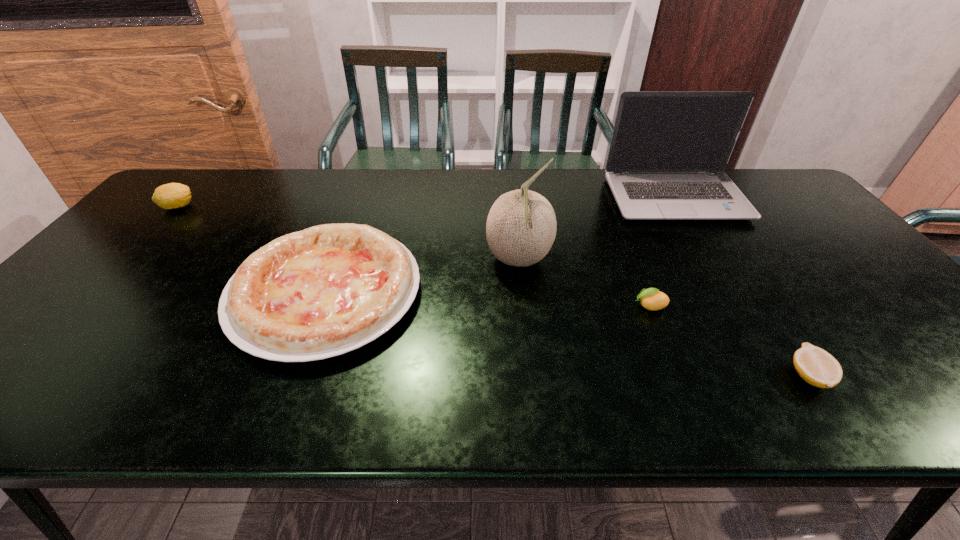
The height and width of the screenshot is (540, 960). Identify the location of laptop computer. (669, 149).

Where is `the fourth object from right to left`? the fourth object from right to left is located at coordinates (521, 226).

Find the location of a particular element. The width and height of the screenshot is (960, 540). pizza is located at coordinates tap(329, 289).

This screenshot has width=960, height=540. Identify the location of the leftmost lemon. (173, 195).

At what (x,y) coordinates should I click in order to perform the action: click on the farthest lemon. Please return your answer as a coordinate pair (x, y). This screenshot has height=540, width=960. Looking at the image, I should click on (173, 195).

At what (x,y) coordinates should I click in order to perform the action: click on the second lemon from left to right. Please return your answer as a coordinate pair (x, y). Looking at the image, I should click on (652, 299).

This screenshot has height=540, width=960. What are the coordinates of `the rightmost lemon` in the screenshot? It's located at (817, 367).

Find the location of a particular element. The image size is (960, 540). free space located on the screen of the laptop computer is located at coordinates (717, 266).

Where is `free point located on the front of the fourth object from right to left`? The image size is (960, 540). free point located on the front of the fourth object from right to left is located at coordinates tap(527, 340).

Locate an element on the screen. The width and height of the screenshot is (960, 540). free space located 0.090m on the left of the pizza is located at coordinates (196, 293).